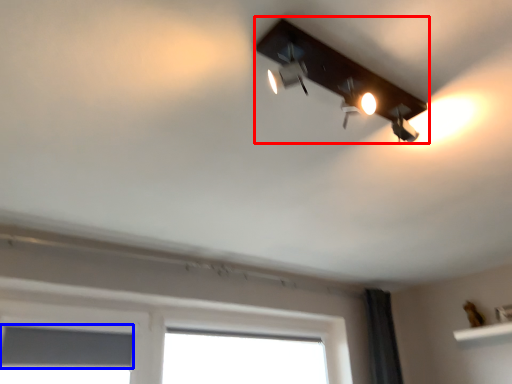
Question: Which object is closer to the camera taking this photo, lamp (highlighted by a red box) or window screen (highlighted by a blue box)?

Choices:
 (A) lamp
 (B) window screen

Answer: (A)